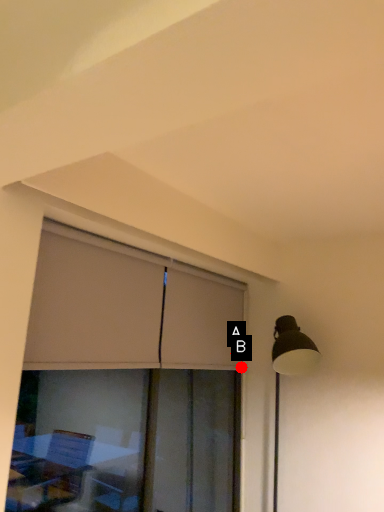
Question: Two points are circled on the image, labeled by A and B beside each circle. Which point is farther to the camera?

Choices:
 (A) A is further
 (B) B is further

Answer: (B)